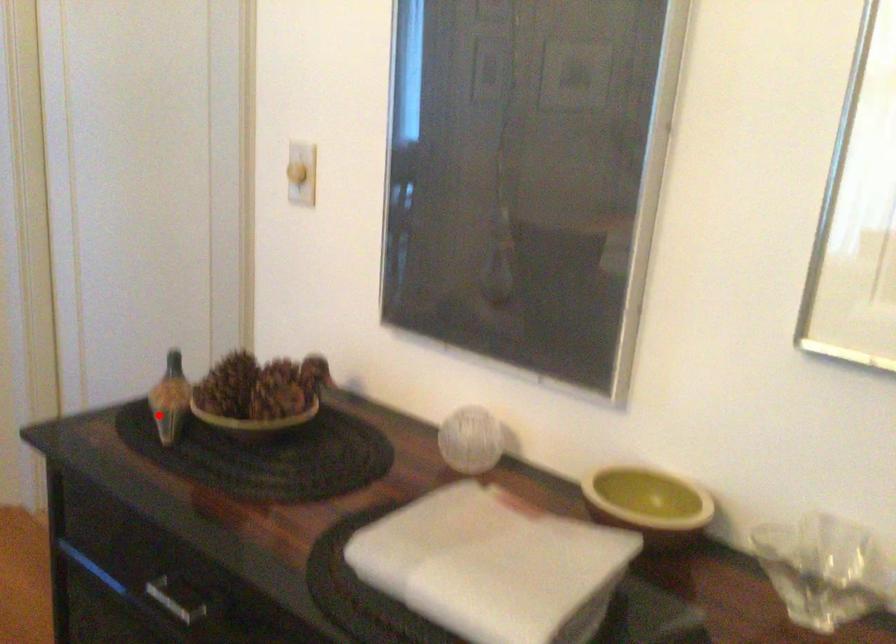
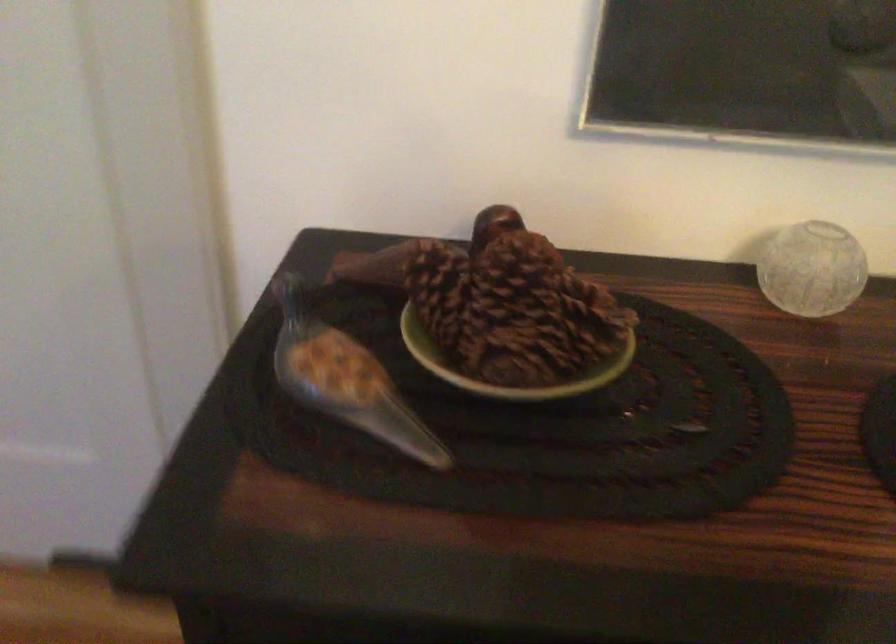
Question: A red point is marked in image1. In image2, is the corresponding 3D point closer to the camera or farther? Reply with the corresponding letter.

Choices:
 (A) The corresponding 3D point is closer.
 (B) The corresponding 3D point is farther.

Answer: (A)